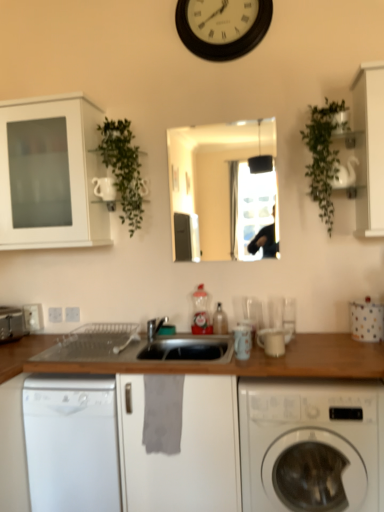
Question: Considering the relative positions of white glossy washing machine at lower right and green leafy plant at upper right, which is counted as the 1th plant, starting from the right, in the image provided, is white glossy washing machine at lower right to the right of green leafy plant at upper right, which is counted as the 1th plant, starting from the right, from the viewer's perspective?

Choices:
 (A) no
 (B) yes

Answer: (A)

Question: Could green leafy plant at upper right, acting as the second plant starting from the left, be considered to be inside white glossy washing machine at lower right?

Choices:
 (A) no
 (B) yes

Answer: (A)

Question: Can you confirm if white glossy washing machine at lower right is positioned to the left of green leafy plant at upper right, which is counted as the 1th plant, starting from the right?

Choices:
 (A) yes
 (B) no

Answer: (A)

Question: Considering the relative sizes of white glossy washing machine at lower right and green leafy plant at upper right, acting as the second plant starting from the left, in the image provided, is white glossy washing machine at lower right shorter than green leafy plant at upper right, acting as the second plant starting from the left,?

Choices:
 (A) yes
 (B) no

Answer: (B)

Question: From a real-world perspective, does white glossy washing machine at lower right stand above green leafy plant at upper right, acting as the second plant starting from the left?

Choices:
 (A) yes
 (B) no

Answer: (B)

Question: Is translucent plastic bottle at center, which is the first bottle from right to left, bigger or smaller than white polka dot fabric at right, which is the 2th appliance from back to front?

Choices:
 (A) small
 (B) big

Answer: (A)

Question: Is translucent plastic bottle at center, which is the first bottle from right to left, situated inside white polka dot fabric at right, the 3th appliance in the front-to-back sequence, or outside?

Choices:
 (A) outside
 (B) inside

Answer: (A)

Question: From their relative heights in the image, would you say translucent plastic bottle at center, which is the 2th bottle from left to right, is taller or shorter than white polka dot fabric at right, which is the first appliance in right-to-left order?

Choices:
 (A) tall
 (B) short

Answer: (B)

Question: Is translucent plastic bottle at center, which is the 2th bottle from left to right, wider or thinner than white polka dot fabric at right, the 4th appliance when ordered from left to right?

Choices:
 (A) wide
 (B) thin

Answer: (B)

Question: Based on their sizes in the image, would you say translucent plastic bottle at center, marked as the second bottle in a right-to-left arrangement, is bigger or smaller than white glossy washing machine at lower right?

Choices:
 (A) small
 (B) big

Answer: (A)

Question: Relative to white glossy washing machine at lower right, is translucent plastic bottle at center, marked as the second bottle in a right-to-left arrangement, in front or behind?

Choices:
 (A) front
 (B) behind

Answer: (B)

Question: Is translucent plastic bottle at center, which is the first bottle from left to right, situated inside white glossy washing machine at lower right or outside?

Choices:
 (A) inside
 (B) outside

Answer: (B)

Question: Does point (198, 301) appear closer or farther from the camera than point (319, 420)?

Choices:
 (A) closer
 (B) farther

Answer: (B)

Question: Relative to white matte clock at upper center, is white glossy washing machine at lower right in front or behind?

Choices:
 (A) behind
 (B) front

Answer: (B)

Question: Visually, is white glossy washing machine at lower right positioned to the left or to the right of white matte clock at upper center?

Choices:
 (A) left
 (B) right

Answer: (B)